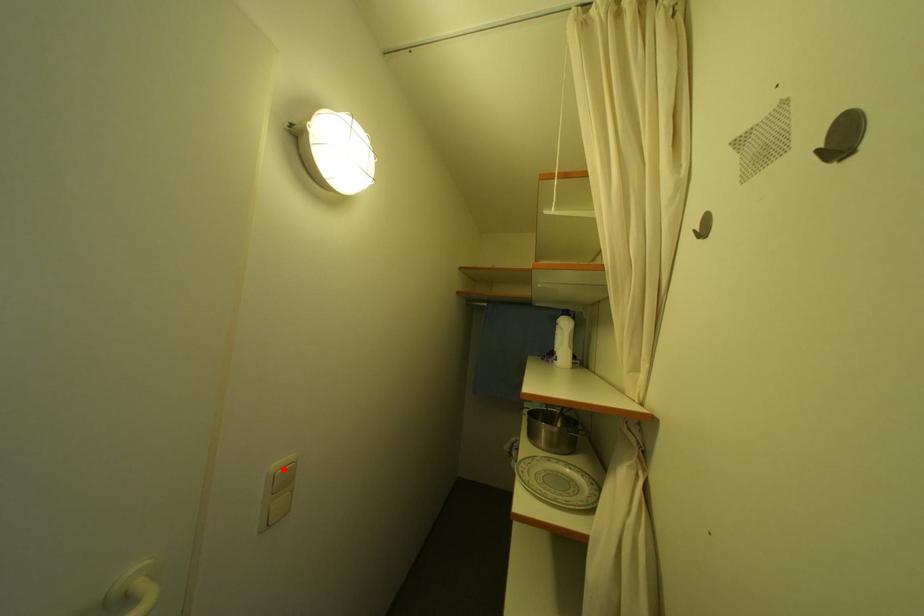
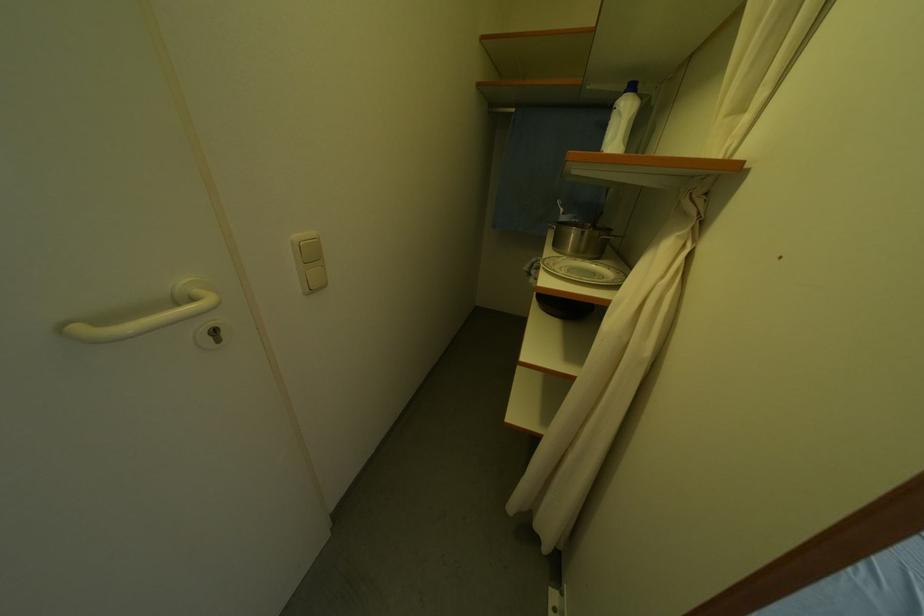
Find the pixel in the second image that matches the highlighted location in the first image.

(306, 238)